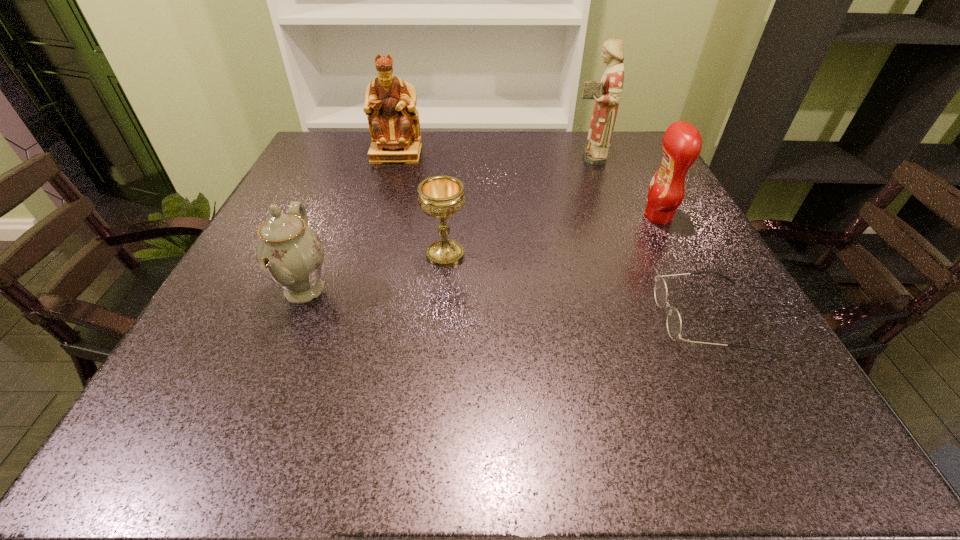
This screenshot has height=540, width=960. What are the coordinates of `the fifth closest object to the condiment` in the screenshot? It's located at (289, 253).

At what (x,y) coordinates should I click in order to perform the action: click on free space that satisfies the following two spatial constraints: 1. on the front-facing side of the second shortest object; 2. on the right side of the left figurine. Please return your answer as a coordinate pair (x, y). The image size is (960, 540). Looking at the image, I should click on (367, 254).